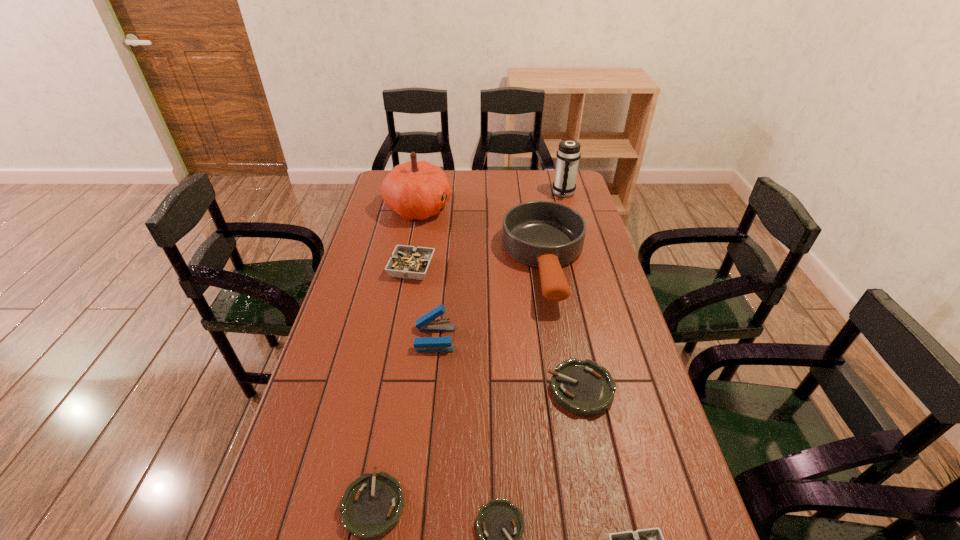
The width and height of the screenshot is (960, 540). In order to click on free space between the sixth shortest object and the thermos bottle in this screenshot , I will do (x=499, y=266).

Where is `vacant area between the thermos bottle and the pumpkin`? The image size is (960, 540). vacant area between the thermos bottle and the pumpkin is located at coordinates (492, 201).

Where is `empty space that is in between the pan and the biggest green ashtray`? empty space that is in between the pan and the biggest green ashtray is located at coordinates (564, 326).

The width and height of the screenshot is (960, 540). Identify the location of empty space that is in between the farthest green ashtray and the sixth shortest object. (508, 364).

The width and height of the screenshot is (960, 540). I want to click on the closest object to the farthest green ashtray, so 547,235.

Select which object appears as the eighth closest to the second shortest ashtray. Please provide its 2D coordinates. Your answer should be formatted as a tuple, i.e. [(x, y)], where the tuple contains the x and y coordinates of a point satisfying the conditions above.

[(568, 154)]

Locate an element on the screen. This screenshot has width=960, height=540. ashtray that stands as the second closest to the biggest green ashtray is located at coordinates (651, 539).

Where is `the closest ashtray to the second shortest ashtray`? the closest ashtray to the second shortest ashtray is located at coordinates (500, 525).

Identify which green ashtray is the nearest to the smaller gray ashtray. Please provide its 2D coordinates. Your answer should be formatted as a tuple, i.e. [(x, y)], where the tuple contains the x and y coordinates of a point satisfying the conditions above.

[(500, 525)]

At what (x,y) coordinates should I click in order to perform the action: click on green ashtray that is the third closest one to the nearer gray ashtray. Please return your answer as a coordinate pair (x, y). The height and width of the screenshot is (540, 960). Looking at the image, I should click on [x=372, y=505].